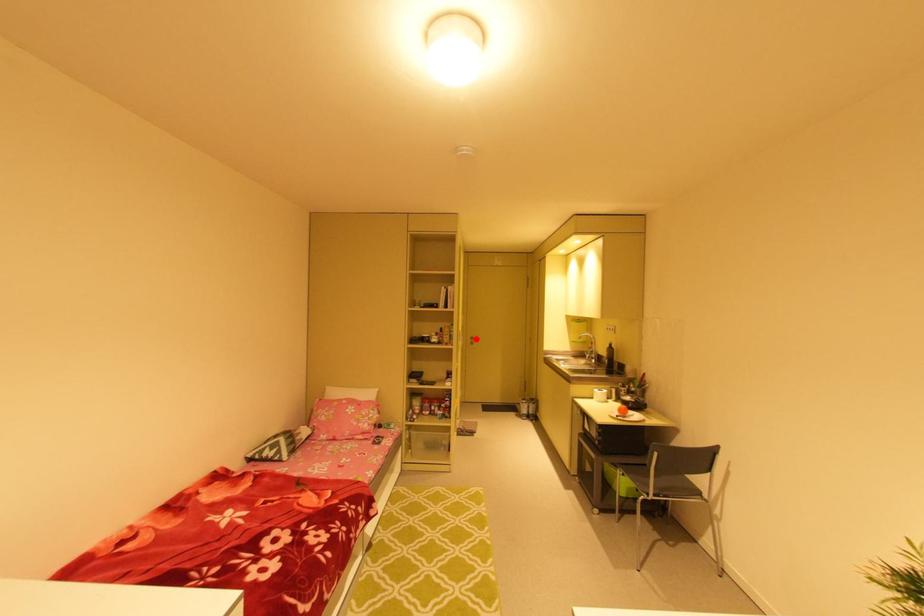
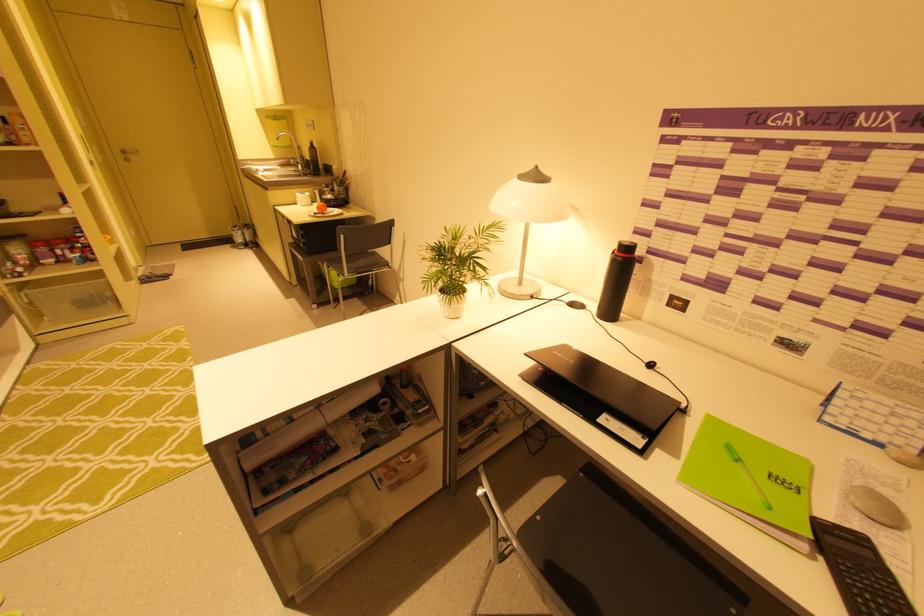
Locate, in the second image, the point that corresponds to the highlighted location in the first image.

(128, 152)